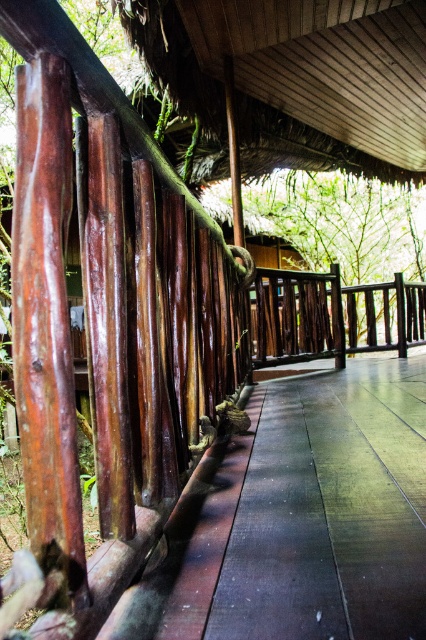
You are standing on the deck and want to walk towards the brown wooden path at center. Which direction should you move relative to the dark brown wood rail at center?

To reach the brown wooden path at center, you should move downward or away from the dark brown wood rail at center since the path is located below the rail.

You are standing on the wooden deck and want to know which object is larger between the green leafy tree at center and the dark brown wood rail at center. Which one is bigger?

The green leafy tree at center is bigger than the dark brown wood rail at center.